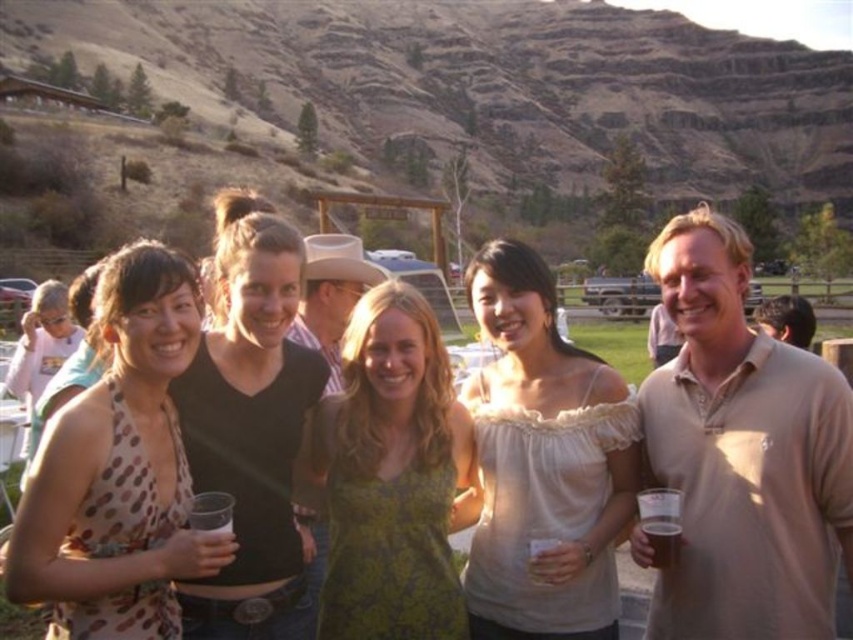
Does point (630, 353) come behind point (329, 275)?

Yes, point (630, 353) is farther from viewer.

Identify the location of matte plastic cup at center. (506, 305).

Does matte black shirt at center have a greater width compared to translucent plastic cup at lower right?

Correct, the width of matte black shirt at center exceeds that of translucent plastic cup at lower right.

Between matte black shirt at center and translucent plastic cup at lower right, which one is positioned lower?

translucent plastic cup at lower right is below.

The height and width of the screenshot is (640, 853). I want to click on matte black shirt at center, so click(251, 428).

Is point (503, 493) positioned in front of point (53, 392)?

No, it is not.

Which is behind, point (534, 440) or point (409, 275)?

The point (409, 275) is more distant.

What are the coordinates of `white lace top at center` in the screenshot? It's located at (543, 461).